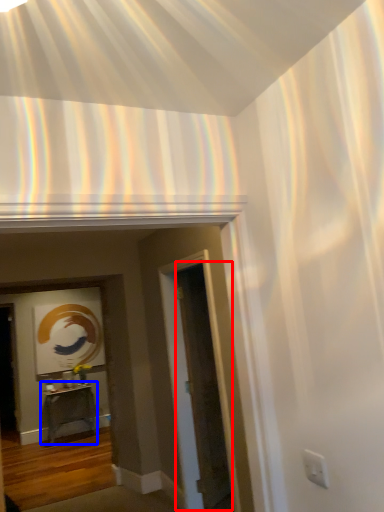
Question: Which point is closer to the camera, glass door (highlighted by a red box) or table (highlighted by a blue box)?

Choices:
 (A) glass door
 (B) table

Answer: (A)